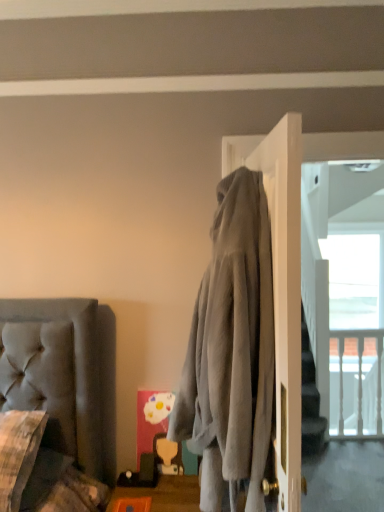
At what (x,y) coordinates should I click in order to perform the action: click on vacant space situated above orange plastic tray at lower center (from a real-world perspective). Please return your answer as a coordinate pair (x, y). The height and width of the screenshot is (512, 384). Looking at the image, I should click on (167, 489).